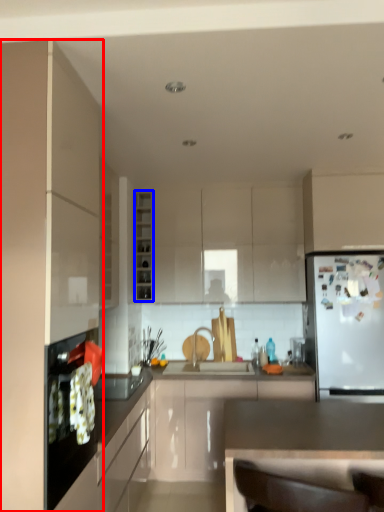
Question: Which object is further to the camera taking this photo, cabinetry (highlighted by a red box) or cabinetry (highlighted by a blue box)?

Choices:
 (A) cabinetry
 (B) cabinetry

Answer: (B)